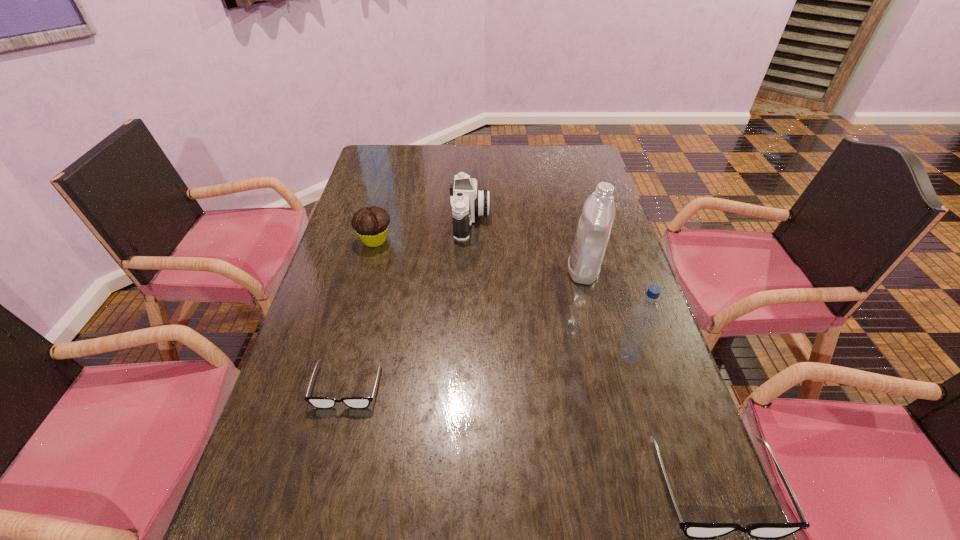
If we want them evenly spaced by inserting an extra spectacles among them, please locate a free spot for this new spectacles. Please provide its 2D coordinates. Your answer should be formatted as a tuple, i.e. [(x, y)], where the tuple contains the x and y coordinates of a point satisfying the conditions above.

[(516, 433)]